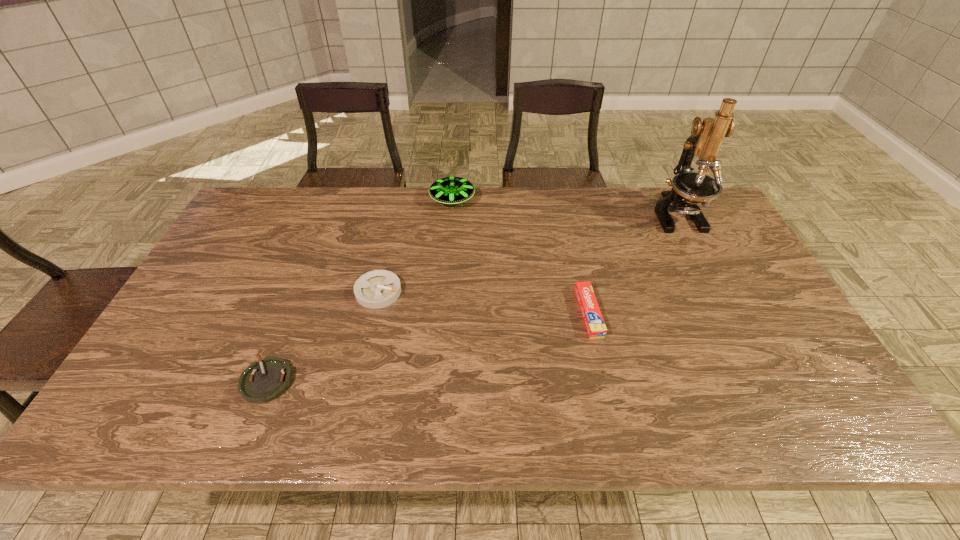
I want to click on vacant space that is in between the right ashtray and the toothpaste, so click(484, 302).

At what (x,y) coordinates should I click in order to perform the action: click on vacant area between the toothpaste and the fourth shortest object. Please return your answer as a coordinate pair (x, y). The height and width of the screenshot is (540, 960). Looking at the image, I should click on (520, 256).

Where is `the closest object to the third object from left to right`? The height and width of the screenshot is (540, 960). the closest object to the third object from left to right is located at coordinates (376, 289).

Locate an element on the screen. the closest object to the nearest object is located at coordinates (376, 289).